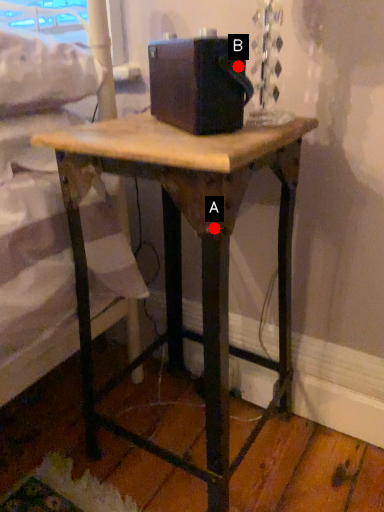
Question: Two points are circled on the image, labeled by A and B beside each circle. Which point is closer to the camera?

Choices:
 (A) A is closer
 (B) B is closer

Answer: (A)